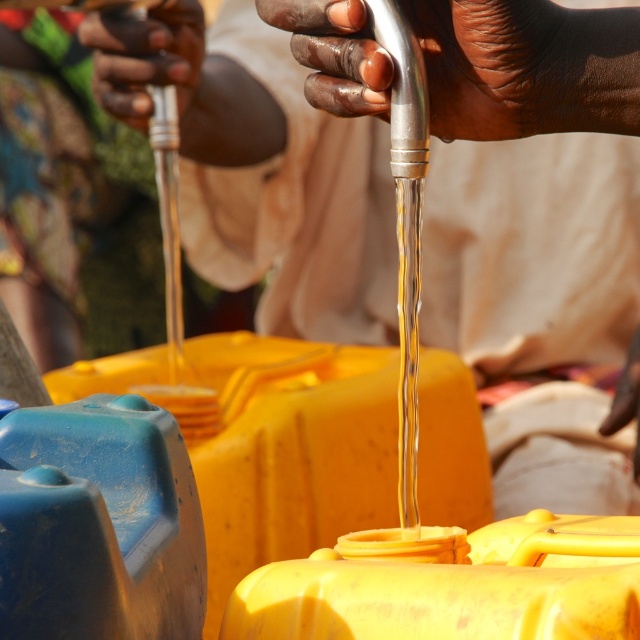
Question: Does metallic silver faucet at upper center have a larger size compared to dark brown skin at upper left?

Choices:
 (A) no
 (B) yes

Answer: (A)

Question: Is metallic silver faucet at upper center to the right of dark brown skin at upper left from the viewer's perspective?

Choices:
 (A) yes
 (B) no

Answer: (A)

Question: Does metallic silver faucet at upper center lie behind dark brown skin at upper left?

Choices:
 (A) no
 (B) yes

Answer: (A)

Question: Which point is closer to the camera?

Choices:
 (A) coord(438,4)
 (B) coord(124,61)

Answer: (A)

Question: Among these points, which one is nearest to the camera?

Choices:
 (A) (490, 65)
 (B) (84, 22)

Answer: (A)

Question: Which point is closer to the camera?

Choices:
 (A) metallic silver faucet at upper center
 (B) dark brown skin at upper left

Answer: (A)